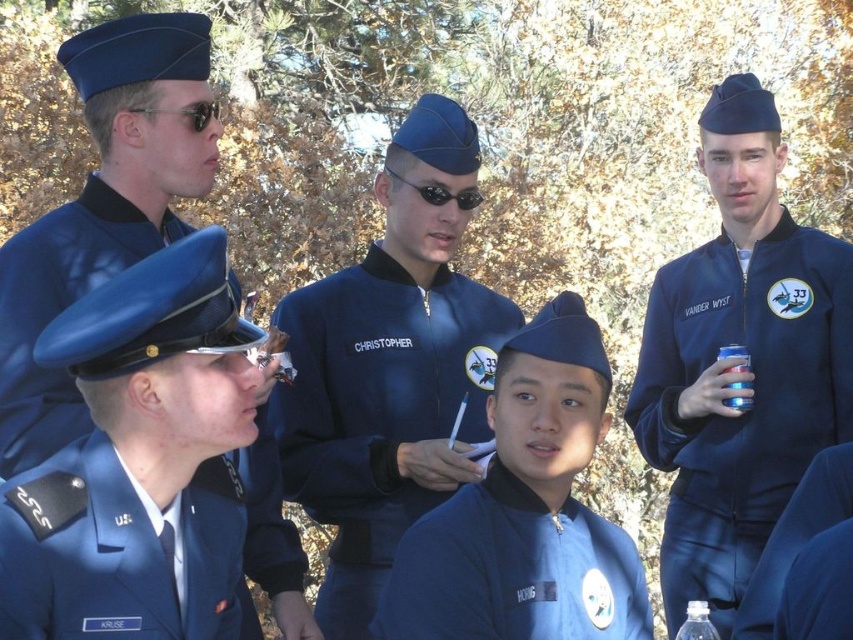
Which is more to the left, navy blue fabric jacket at center or blue fabric uniform at lower left?

blue fabric uniform at lower left

Does navy blue fabric jacket at center appear on the right side of blue fabric uniform at lower left?

Correct, you'll find navy blue fabric jacket at center to the right of blue fabric uniform at lower left.

Is point (306, 376) positioned in front of point (234, 525)?

No, (306, 376) is further to viewer.

Locate an element on the screen. This screenshot has width=853, height=640. navy blue fabric jacket at center is located at coordinates (376, 408).

Is point (280, 570) farther from viewer compared to point (393, 513)?

No, (280, 570) is in front of (393, 513).

Is matte blue uniform at upper left taller than navy blue fabric jacket at center?

In fact, matte blue uniform at upper left may be shorter than navy blue fabric jacket at center.

The height and width of the screenshot is (640, 853). Describe the element at coordinates (103, 205) in the screenshot. I see `matte blue uniform at upper left` at that location.

Locate an element on the screen. This screenshot has height=640, width=853. matte blue uniform at upper left is located at coordinates (103, 205).

Is point (849, 355) behind point (210, 113)?

Yes, point (849, 355) is farther from viewer.

Can you confirm if blue matte jacket at upper right is bigger than matte blue uniform at upper left?

Yes.

The width and height of the screenshot is (853, 640). What are the coordinates of `blue matte jacket at upper right` in the screenshot? It's located at (751, 397).